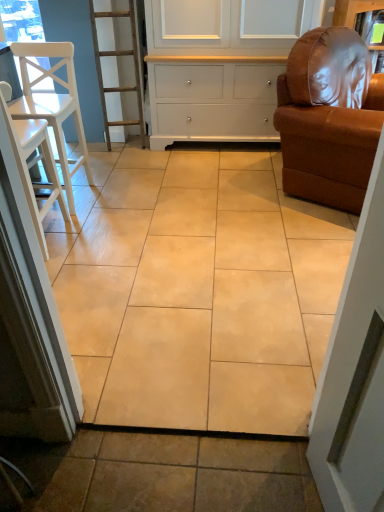
Image resolution: width=384 pixels, height=512 pixels. I want to click on vacant space situated on the left part of brown leather armchair at right, the third chair in the left-to-right sequence, so click(220, 188).